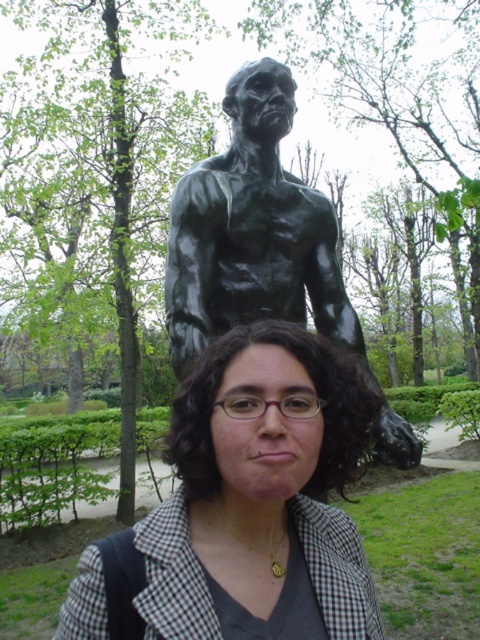
You are a photographer trying to capture the bronze statue at center without the matte black jacket at center in the frame. Which direction should you move relative to the statue to ensure the jacket is out of the shot?

Move to the left side of the bronze statue at center so that the matte black jacket at center is no longer in the frame since it is positioned to the right of the statue.

You are a photographer trying to capture both the matte black jacket at center and the bronze statue at center in a single frame. Based on their heights, which object will appear smaller in the photo?

The matte black jacket at center will appear smaller in the photo because it has a lesser height compared to the bronze statue at center.